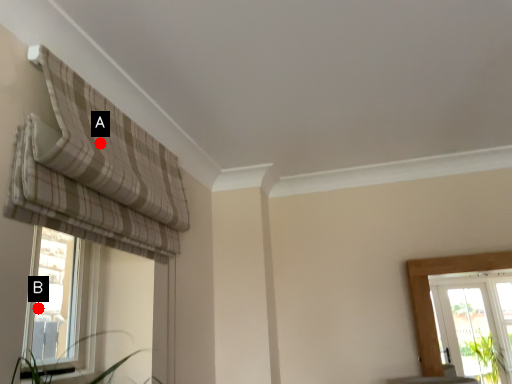
Question: Two points are circled on the image, labeled by A and B beside each circle. Among these points, which one is nearest to the camera?

Choices:
 (A) A is closer
 (B) B is closer

Answer: (A)